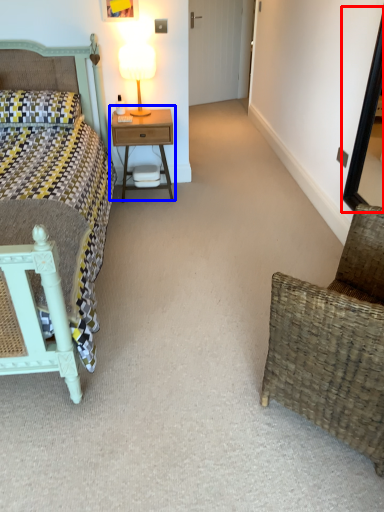
Question: Which point is further to the camera, mirror (highlighted by a red box) or nightstand (highlighted by a blue box)?

Choices:
 (A) mirror
 (B) nightstand

Answer: (B)